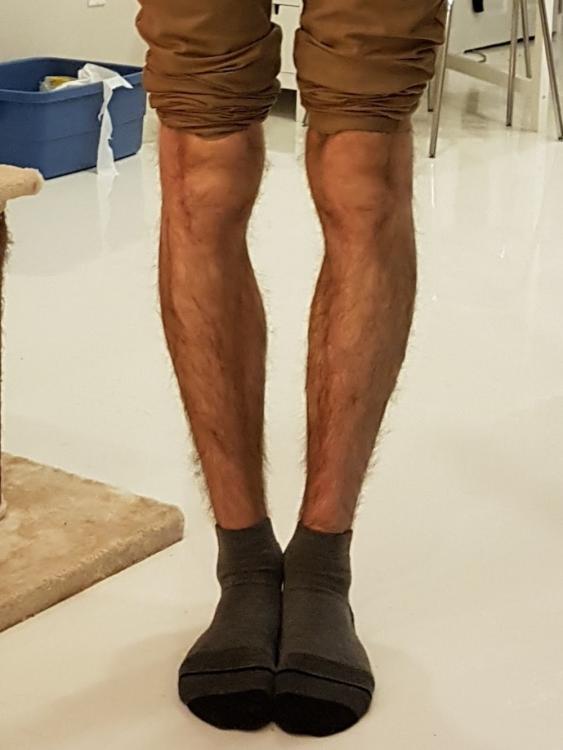
Identify the location of marble floor. (91, 220).